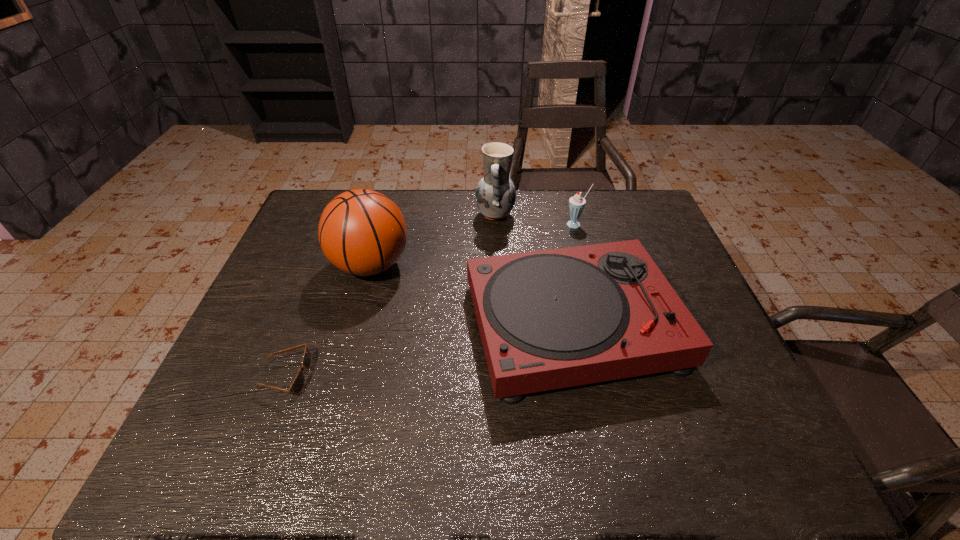
The image size is (960, 540). What are the coordinates of `pottery` in the screenshot? It's located at (495, 194).

The image size is (960, 540). What are the coordinates of `basketball` in the screenshot? It's located at (362, 232).

Locate an element on the screen. milkshake is located at coordinates (577, 203).

At what (x,y) coordinates should I click in order to perform the action: click on record player. Please return your answer as a coordinate pair (x, y). Image resolution: width=960 pixels, height=540 pixels. Looking at the image, I should click on (550, 319).

Where is `sunglasses`? This screenshot has height=540, width=960. sunglasses is located at coordinates (297, 386).

This screenshot has width=960, height=540. Identify the location of vacant space located on either side of the pottery. (436, 215).

Where is `vacant area situated on either side of the pottery`? vacant area situated on either side of the pottery is located at coordinates (436, 215).

Locate an element on the screen. vacant space positioned 0.250m on either side of the pottery is located at coordinates (399, 215).

At what (x,y) coordinates should I click in order to perform the action: click on vacant space located 0.380m on the front of the basketball. Please return your answer as a coordinate pair (x, y). The height and width of the screenshot is (540, 960). Looking at the image, I should click on (326, 427).

Where is `vacant point located on the straw side of the milkshake`? This screenshot has height=540, width=960. vacant point located on the straw side of the milkshake is located at coordinates (600, 315).